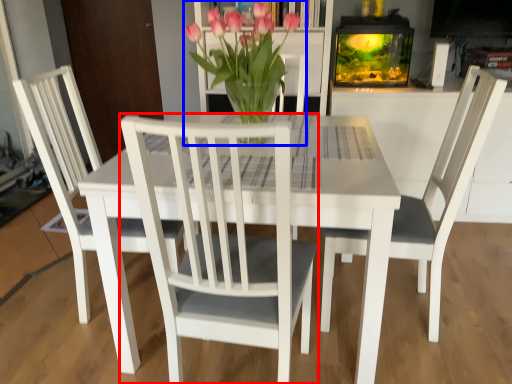
Question: Which object is closer to the camera taking this photo, chair (highlighted by a red box) or houseplant (highlighted by a blue box)?

Choices:
 (A) chair
 (B) houseplant

Answer: (A)